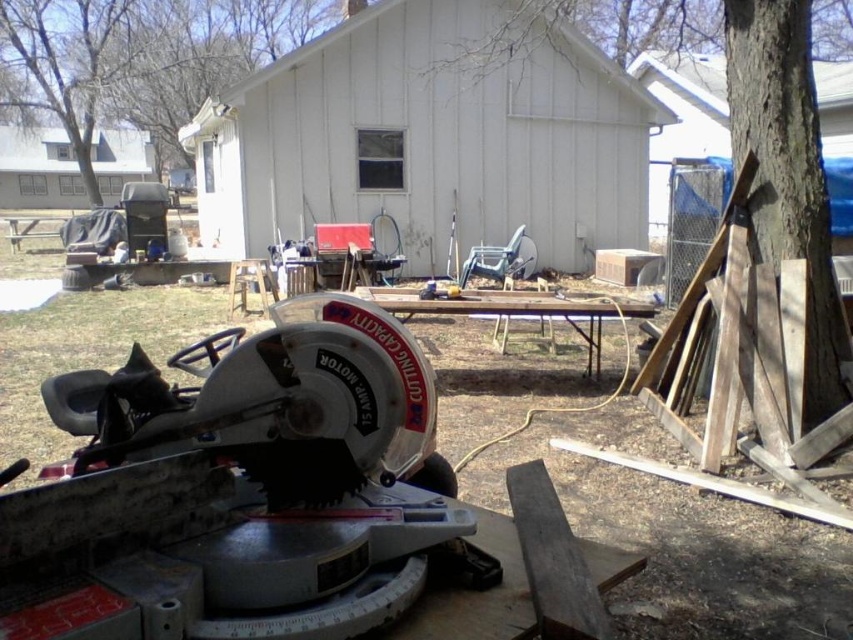
Is brown rough wood at right taller than brown rough bark tree at right?

Yes.

Which is above, brown rough wood at right or brown rough bark tree at right?

brown rough wood at right is above.

The image size is (853, 640). In order to click on brown rough wood at right in this screenshot , I will do `click(785, 168)`.

Between green textured tree at upper center and brown rough wood at right, which one appears on the right side from the viewer's perspective?

brown rough wood at right is more to the right.

Based on the photo, does green textured tree at upper center have a lesser height compared to brown rough wood at right?

Correct, green textured tree at upper center is not as tall as brown rough wood at right.

Which is in front, point (120, 38) or point (804, 250)?

Point (804, 250) is in front.

Identify the location of green textured tree at upper center. (138, 58).

What do you see at coordinates (236, 490) in the screenshot?
I see `metallic gray circular saw at center` at bounding box center [236, 490].

Between metallic gray circular saw at center and brown rough wood at right, which one appears on the right side from the viewer's perspective?

Positioned to the right is brown rough wood at right.

Who is more forward, (x=305, y=348) or (x=767, y=259)?

Point (x=305, y=348) is in front.

The width and height of the screenshot is (853, 640). I want to click on metallic gray circular saw at center, so click(x=236, y=490).